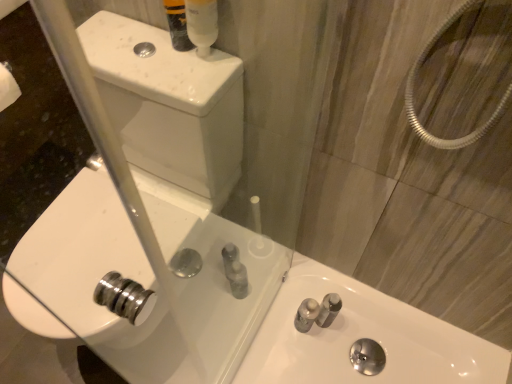
Question: Considering their positions, is white glossy sink at center, the 2th sink when ordered from right to left, located in front of or behind translucent plastic mouthwash at upper center?

Choices:
 (A) behind
 (B) front

Answer: (B)

Question: Is point (62, 14) closer or farther from the camera than point (212, 16)?

Choices:
 (A) closer
 (B) farther

Answer: (A)

Question: Estimate the real-world distances between objects in this image. Which object is closer to the translucent plastic mouthwash at upper center?

Choices:
 (A) white glossy sink at lower right, the 2th sink when ordered from left to right
 (B) translucent plastic tube at upper center
 (C) white glossy sink at center, which is counted as the first sink, starting from the left

Answer: (B)

Question: Estimate the real-world distances between objects in this image. Which object is farther from the translucent plastic mouthwash at upper center?

Choices:
 (A) translucent plastic tube at upper center
 (B) white glossy sink at lower right, the first sink positioned from the right
 (C) white glossy sink at center, the 2th sink when ordered from right to left

Answer: (B)